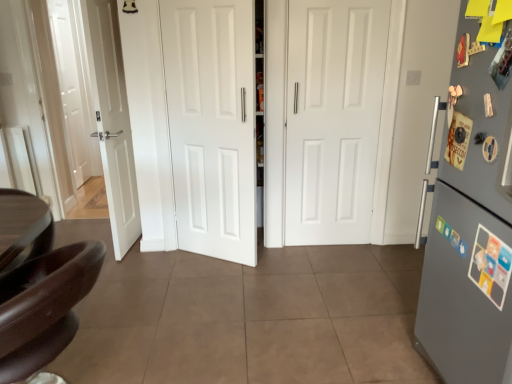
Question: Is gray matte refrigerator at right facing away from white matte door at center, positioned as the first door in right-to-left order?

Choices:
 (A) yes
 (B) no

Answer: (B)

Question: Is gray matte refrigerator at right facing towards white matte door at center, the second door viewed from the left?

Choices:
 (A) yes
 (B) no

Answer: (B)

Question: From a real-world perspective, is gray matte refrigerator at right physically above white matte door at center, the second door viewed from the left?

Choices:
 (A) yes
 (B) no

Answer: (B)

Question: Does gray matte refrigerator at right contain white matte door at center, the second door viewed from the left?

Choices:
 (A) no
 (B) yes

Answer: (A)

Question: From the image's perspective, does gray matte refrigerator at right appear lower than white matte door at center, positioned as the first door in right-to-left order?

Choices:
 (A) no
 (B) yes

Answer: (B)

Question: In terms of height, does shiny brown leather chair at lower left look taller or shorter compared to white matte door at center, which is counted as the 1th door, starting from the left?

Choices:
 (A) tall
 (B) short

Answer: (B)

Question: Considering their positions, is shiny brown leather chair at lower left located in front of or behind white matte door at center, the second door viewed from the right?

Choices:
 (A) front
 (B) behind

Answer: (A)

Question: Considering the positions of shiny brown leather chair at lower left and white matte door at center, which is counted as the 1th door, starting from the left, in the image, is shiny brown leather chair at lower left bigger or smaller than white matte door at center, which is counted as the 1th door, starting from the left,?

Choices:
 (A) small
 (B) big

Answer: (B)

Question: From the image's perspective, is shiny brown leather chair at lower left positioned above or below white matte door at center, which is counted as the 1th door, starting from the left?

Choices:
 (A) above
 (B) below

Answer: (B)

Question: In terms of width, does gray matte refrigerator at right look wider or thinner when compared to white matte door at center, the second door viewed from the left?

Choices:
 (A) wide
 (B) thin

Answer: (A)

Question: From a real-world perspective, relative to white matte door at center, the second door viewed from the left, is gray matte refrigerator at right vertically above or below?

Choices:
 (A) below
 (B) above

Answer: (A)

Question: Is gray matte refrigerator at right inside the boundaries of white matte door at center, the second door viewed from the left, or outside?

Choices:
 (A) outside
 (B) inside

Answer: (A)

Question: Does point (458, 144) appear closer or farther from the camera than point (298, 157)?

Choices:
 (A) farther
 (B) closer

Answer: (B)

Question: Which is correct: white matte door at center, the second door viewed from the left, is inside shiny brown leather chair at lower left, or outside of it?

Choices:
 (A) inside
 (B) outside

Answer: (B)

Question: Is white matte door at center, the second door viewed from the left, taller or shorter than shiny brown leather chair at lower left?

Choices:
 (A) tall
 (B) short

Answer: (A)